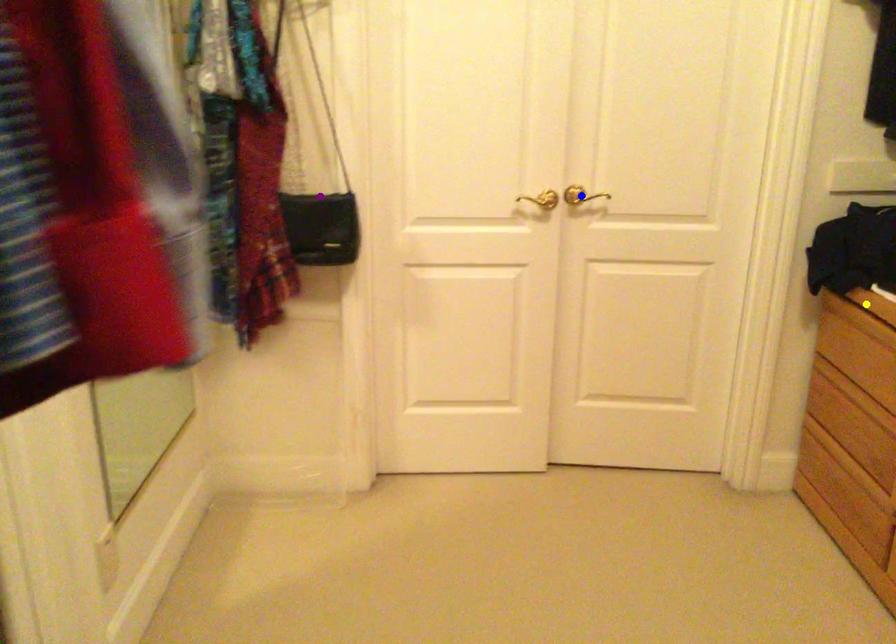
Order these from nearest to farthest:
blue point, purple point, yellow point

1. blue point
2. purple point
3. yellow point